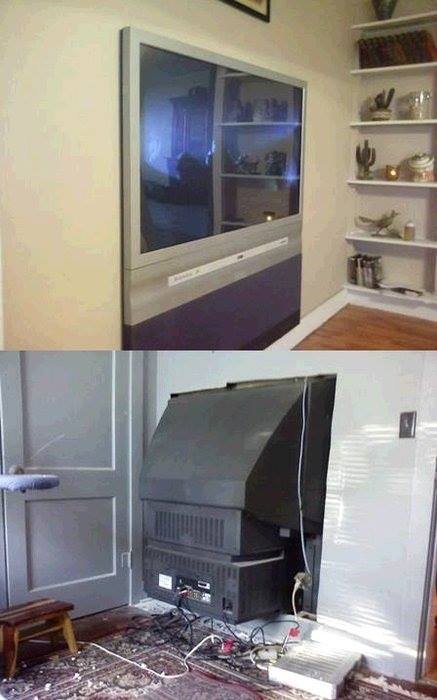
The width and height of the screenshot is (437, 700). Identify the location of wooden stool. (33, 617).